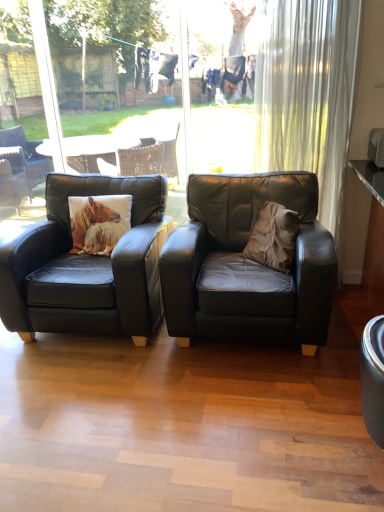
Where is `free location in front of black leather chair at center, which appears as the second chair when viewed from the right`? This screenshot has height=512, width=384. free location in front of black leather chair at center, which appears as the second chair when viewed from the right is located at coordinates (102, 404).